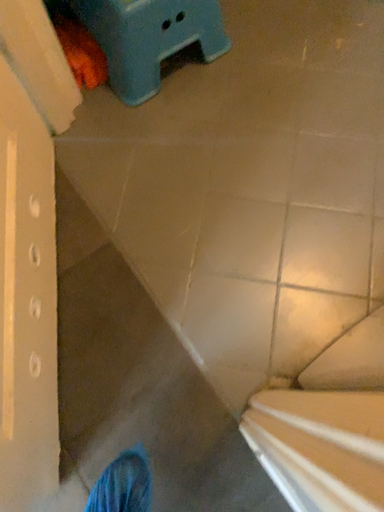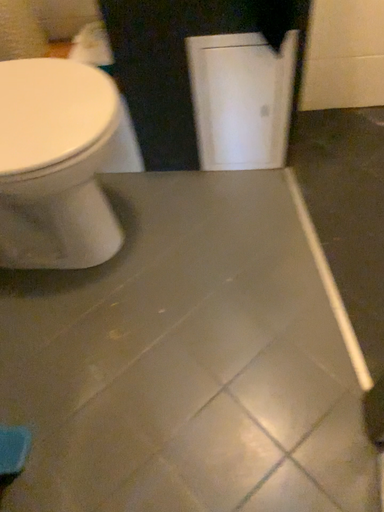
Question: How did the camera likely rotate when shooting the video?

Choices:
 (A) rotated downward
 (B) rotated upward

Answer: (B)